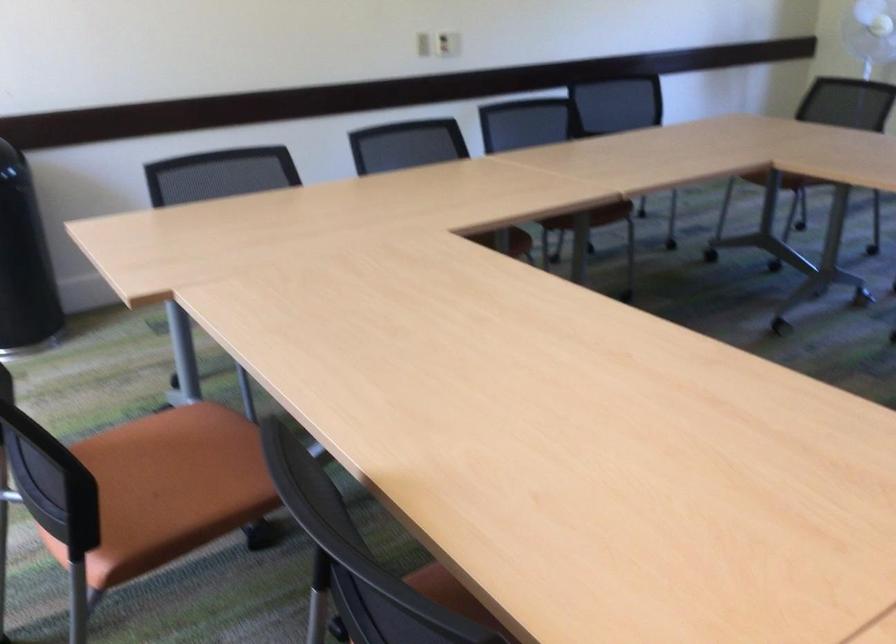
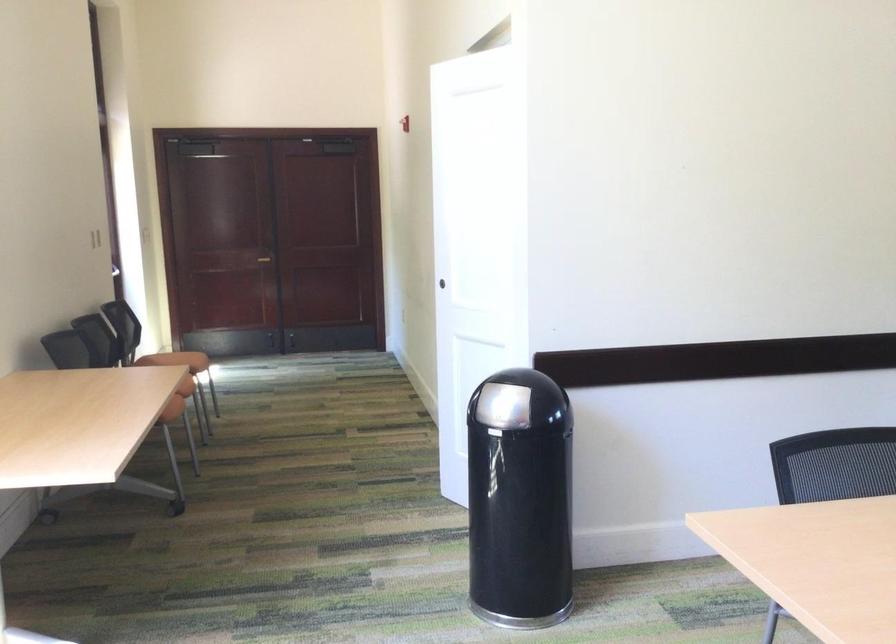
Question: How did the camera likely rotate?

Choices:
 (A) Left
 (B) Right
 (C) Up
 (D) Down

Answer: (A)